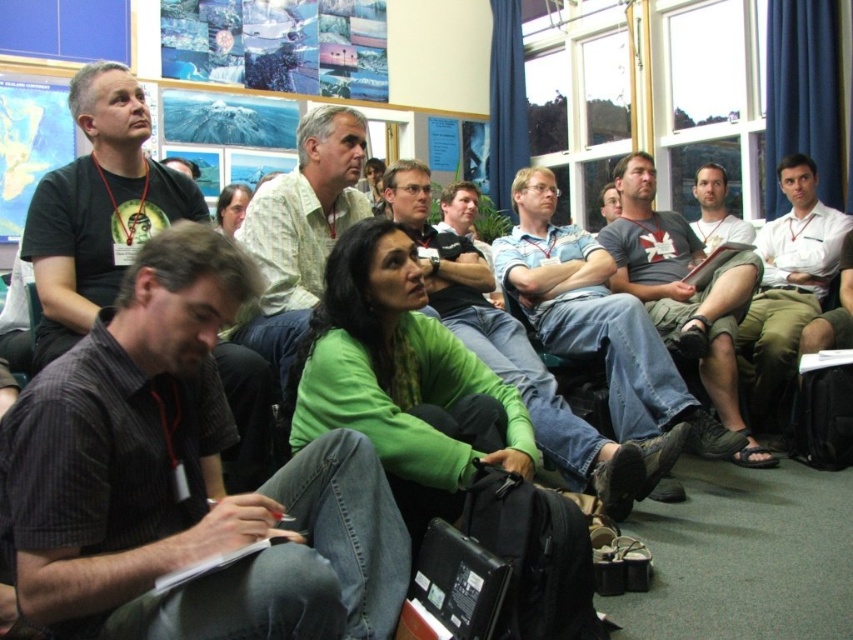
Question: Which of the following is the farthest from the observer?

Choices:
 (A) coord(747,419)
 (B) coord(47,378)
 (C) coord(554,435)
 (D) coord(152,228)

Answer: (A)

Question: Can you confirm if black matte t-shirt at upper left is thinner than green matte sweater at center?

Choices:
 (A) yes
 (B) no

Answer: (A)

Question: Which point is farther to the camera?

Choices:
 (A) green matte sweater at center
 (B) light green shirt at center

Answer: (A)

Question: Which object appears farthest from the camera in this image?

Choices:
 (A) matte gray shirt at center
 (B) dark gray striped shirt at lower left
 (C) black matte t-shirt at upper left
 (D) gray cotton t-shirt at center

Answer: (A)

Question: Does white shirt at center have a lesser width compared to matte gray shirt at center?

Choices:
 (A) no
 (B) yes

Answer: (A)

Question: Is light green shirt at center thinner than white shirt at center?

Choices:
 (A) no
 (B) yes

Answer: (B)